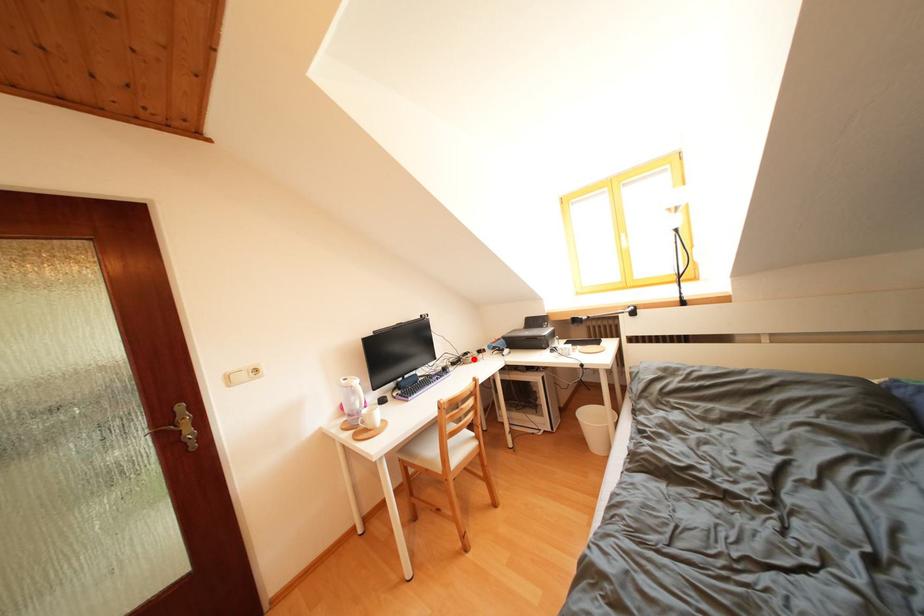
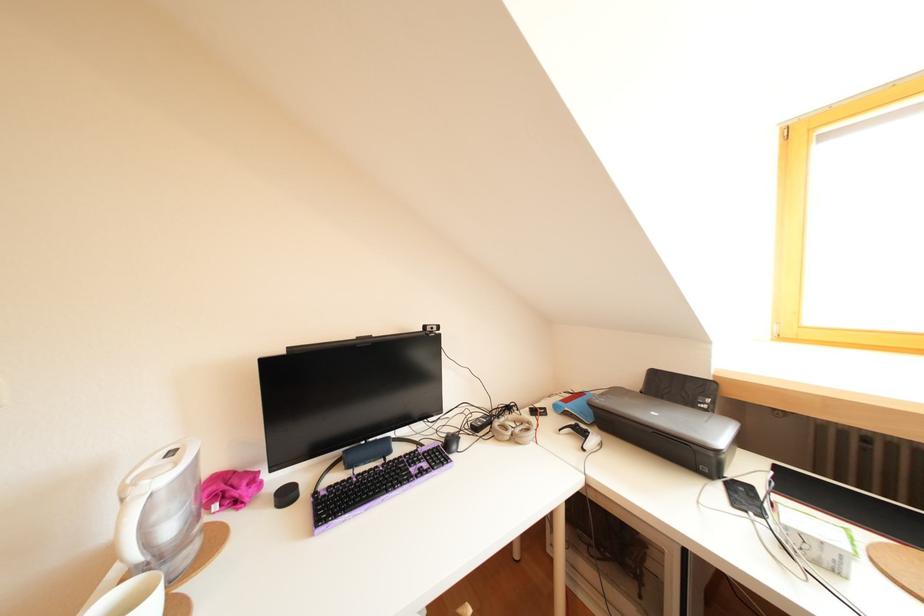
The point at the highlighted location is marked in the first image. Where is the corresponding point in the second image?

(516, 413)